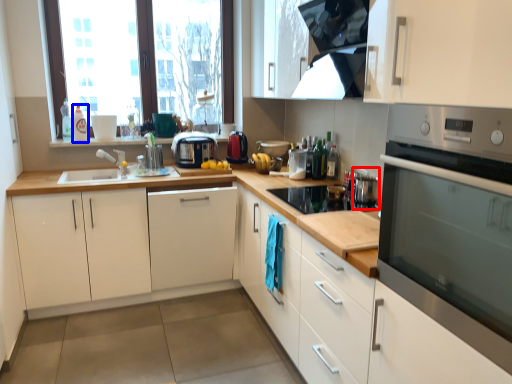
Question: Which object is closer to the camera taking this photo, appliance (highlighted by a red box) or bottle (highlighted by a blue box)?

Choices:
 (A) appliance
 (B) bottle

Answer: (A)